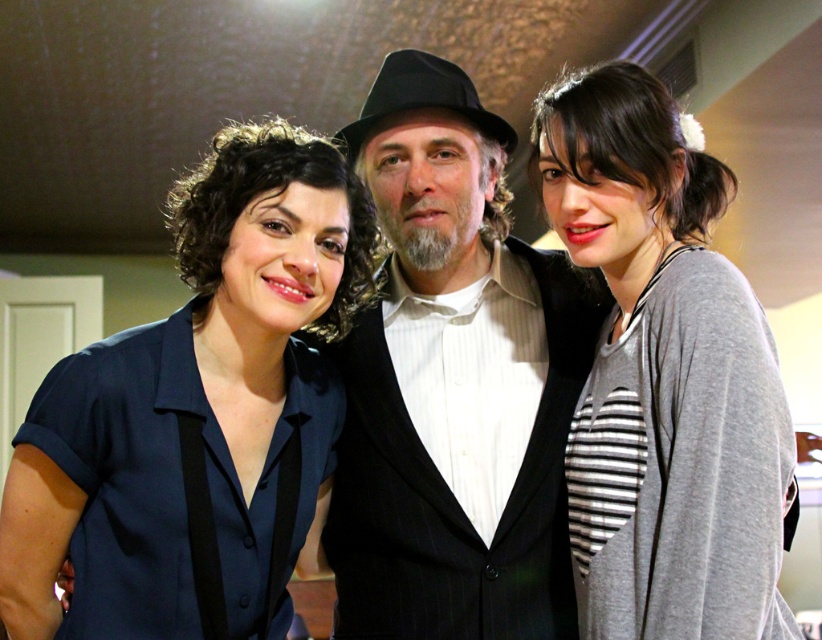
Question: Is matte blue shirt at left wider than gray striped shirt at center?

Choices:
 (A) no
 (B) yes

Answer: (B)

Question: Which object is positioned closest to the matte blue shirt at left?

Choices:
 (A) black pinstripe suit at center
 (B) gray striped shirt at center

Answer: (A)

Question: Considering the real-world distances, which object is closest to the gray striped shirt at center?

Choices:
 (A) black pinstripe suit at center
 (B) matte blue shirt at left

Answer: (A)

Question: Does black pinstripe suit at center have a larger size compared to gray striped shirt at center?

Choices:
 (A) yes
 (B) no

Answer: (B)

Question: Is black pinstripe suit at center thinner than gray striped shirt at center?

Choices:
 (A) yes
 (B) no

Answer: (B)

Question: Which point appears closest to the camera in this image?

Choices:
 (A) (409, 292)
 (B) (187, 250)
 (C) (681, 376)

Answer: (C)